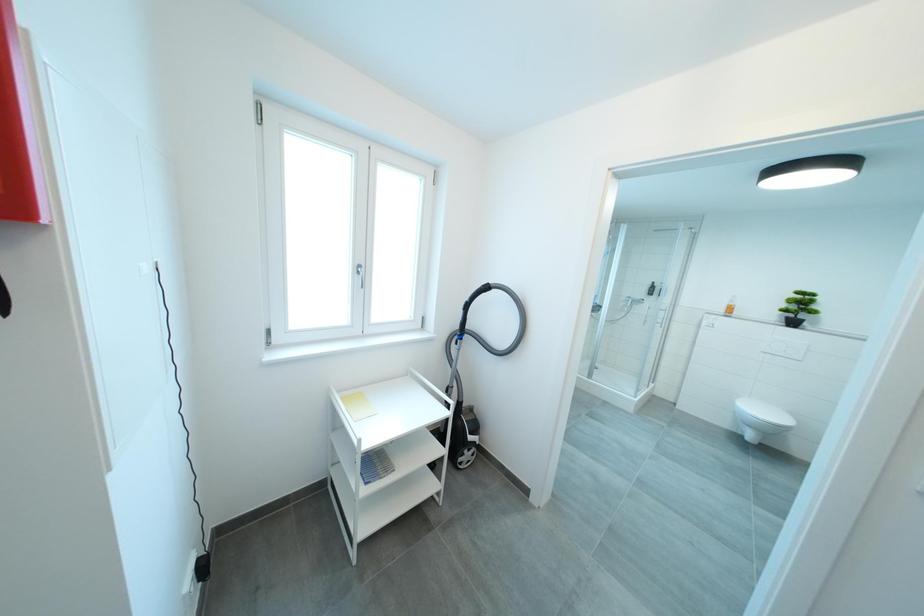
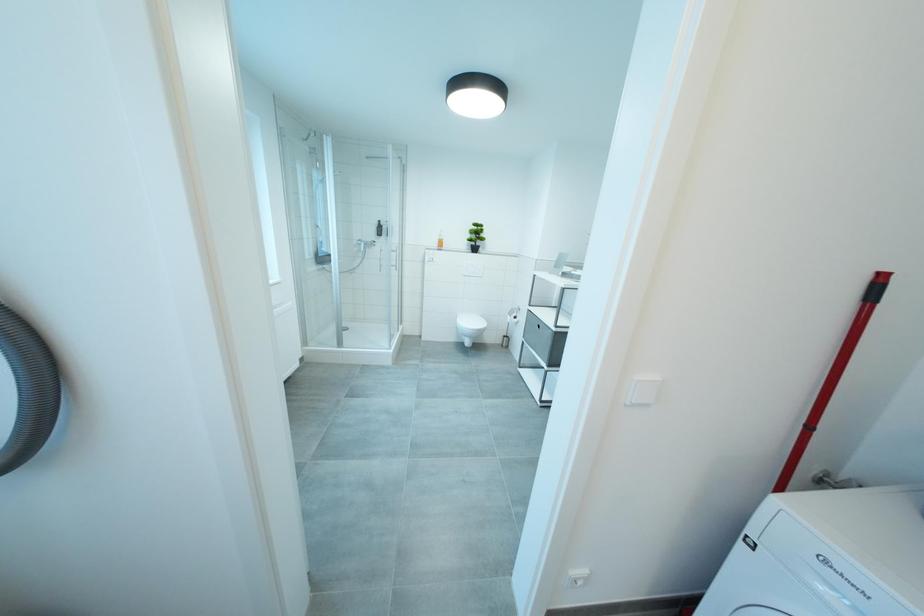
The first image is from the beginning of the video and the second image is from the end. How did the camera likely rotate when shooting the video?

The camera rotated toward right-down.